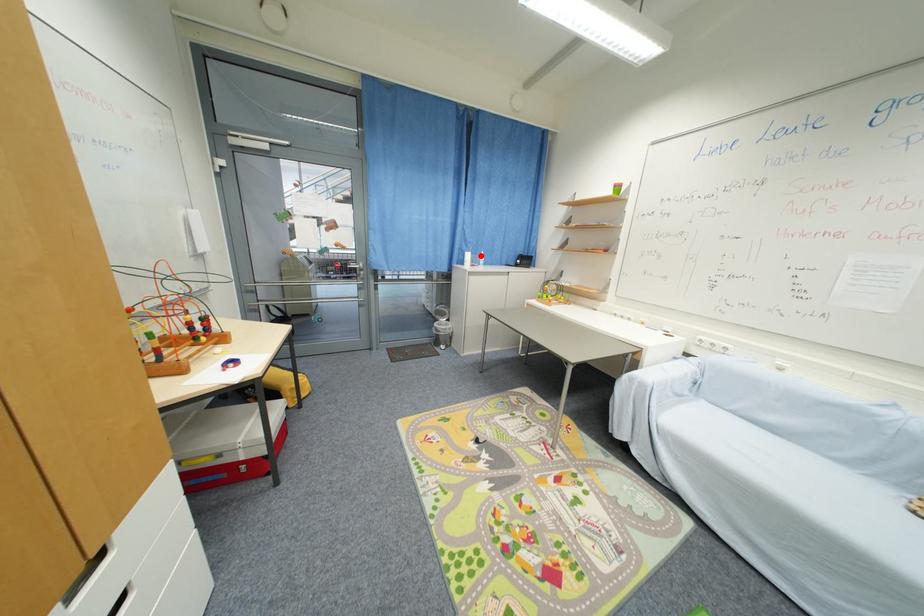
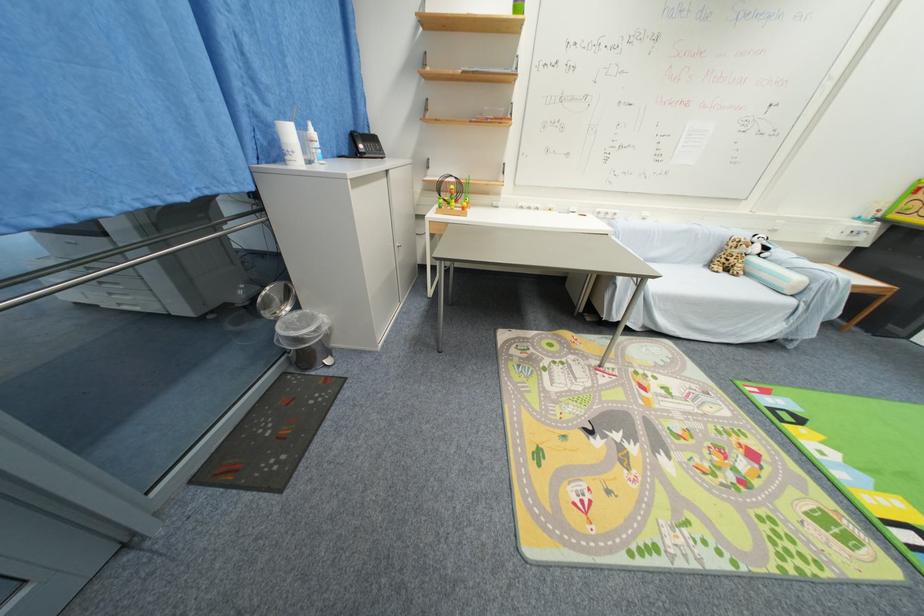
Where in the second image is the point corresponding to the highlighted location from the first image?

(306, 129)